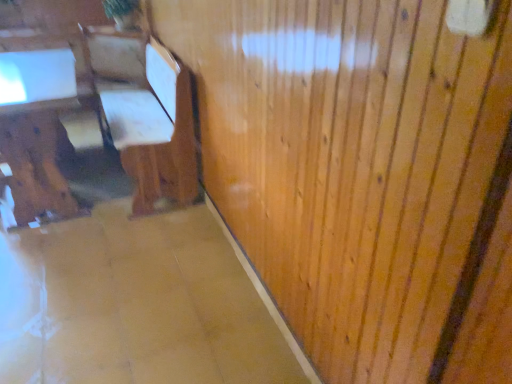
Find the location of a particular element. Image resolution: width=512 pixels, height=384 pixels. vacant area that is in front of matte brown table at left is located at coordinates point(65,270).